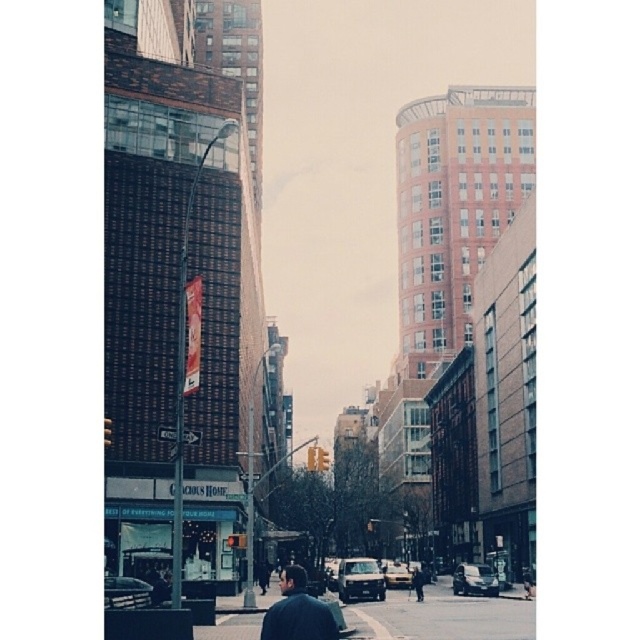
Question: Is smooth asphalt road at center to the right of dark blue jacket at center from the viewer's perspective?

Choices:
 (A) yes
 (B) no

Answer: (A)

Question: Does smooth asphalt road at center have a greater width compared to dark blue jacket at center?

Choices:
 (A) no
 (B) yes

Answer: (B)

Question: Which point is farther to the camera?

Choices:
 (A) dark blue jacket at center
 (B) smooth asphalt road at center

Answer: (B)

Question: Considering the relative positions of smooth asphalt road at center and dark blue jacket at center in the image provided, where is smooth asphalt road at center located with respect to dark blue jacket at center?

Choices:
 (A) left
 (B) right

Answer: (B)

Question: Which point is farther to the camera?

Choices:
 (A) smooth asphalt road at center
 (B) dark blue jacket at center

Answer: (A)